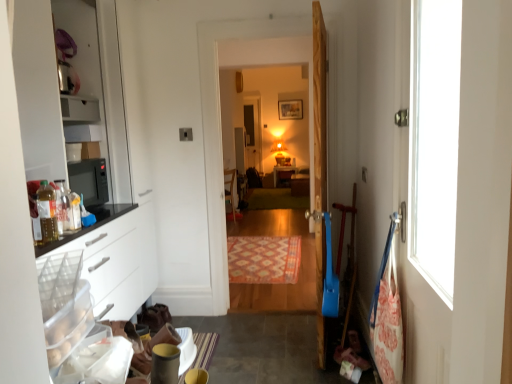
This screenshot has height=384, width=512. Identify the location of white glossy dresser at left. (69, 95).

I want to click on carpeted wooden floor at center, so click(x=267, y=100).

Where is `wooden door at center`? wooden door at center is located at coordinates (319, 165).

From the image's perspective, which is above, green carpet at center, which is the 2th mat from bottom to top, or translucent plastic bottle at left?

translucent plastic bottle at left appears higher in the image.

Identify the location of food to the left of green carpet at center, the 1th mat positioned from the back. The image size is (512, 384). (46, 210).

Is translucent plastic bottle at left a part of green carpet at center, the 1th mat positioned from the back?

No, translucent plastic bottle at left is not a part of green carpet at center, the 1th mat positioned from the back.

Who is bigger, wooden table at center or wooden door at center?

wooden door at center is bigger.

Is wooden table at center to the right of wooden door at center from the viewer's perspective?

Yes.

Is wooden table at center further to camera compared to wooden door at center?

Yes, wooden table at center is further from the viewer.

Is point (277, 174) positioned in front of point (314, 91)?

No, (277, 174) is behind (314, 91).

Between matte yellow concrete at lower left and matte white cabinet at center, which one is positioned in front?

matte yellow concrete at lower left is more forward.

Considering the positions of point (190, 317) and point (298, 181), is point (190, 317) closer or farther from the camera than point (298, 181)?

Point (190, 317) is positioned closer to the camera compared to point (298, 181).

From the image's perspective, which one is positioned higher, matte yellow concrete at lower left or matte white cabinet at center?

matte white cabinet at center.

Does matte yellow concrete at lower left turn towards matte white cabinet at center?

No.

Which of these two, matte white cabinet at center or wooden table at center, is thinner?

With smaller width is matte white cabinet at center.

Is matte white cabinet at center taller or shorter than wooden table at center?

Clearly, matte white cabinet at center is shorter compared to wooden table at center.

Considering their positions, is matte white cabinet at center located in front of or behind wooden table at center?

Clearly, matte white cabinet at center is in front of wooden table at center.

Is patterned carpet at center, the 2th mat in the back-to-front sequence, facing towards white glossy dresser at left?

No, patterned carpet at center, the 2th mat in the back-to-front sequence, is not turned towards white glossy dresser at left.

Between patterned carpet at center, the 2th mat in the back-to-front sequence, and white glossy dresser at left, which one has smaller width?

Thinner between the two is white glossy dresser at left.

Considering the relative sizes of patterned carpet at center, the 1th mat in the front-to-back sequence, and white glossy dresser at left in the image provided, is patterned carpet at center, the 1th mat in the front-to-back sequence, taller than white glossy dresser at left?

No, patterned carpet at center, the 1th mat in the front-to-back sequence, is not taller than white glossy dresser at left.

Between patterned carpet at center, the 1th mat in the front-to-back sequence, and white glossy dresser at left, which one appears on the right side from the viewer's perspective?

Positioned to the right is patterned carpet at center, the 1th mat in the front-to-back sequence.

Which of these two, matte yellow concrete at lower left or white glossy dresser at left, is smaller?

matte yellow concrete at lower left is smaller.

Does matte yellow concrete at lower left have a greater width compared to white glossy dresser at left?

Yes.

Looking at this image, from the image's perspective, is matte yellow concrete at lower left located above white glossy dresser at left?

No.

Which is correct: matte yellow concrete at lower left is inside white glossy dresser at left, or outside of it?

The correct answer is: outside.

The width and height of the screenshot is (512, 384). I want to click on corridor lying behind the wooden door at center, so click(x=267, y=100).

Is carpeted wooden floor at center taller or shorter than wooden door at center?

Clearly, carpeted wooden floor at center is taller compared to wooden door at center.

From a real-world perspective, is carpeted wooden floor at center on wooden door at center?

Correct, in the physical world, carpeted wooden floor at center is higher than wooden door at center.

This screenshot has width=512, height=384. What are the coordinates of `food above the green carpet at center, which is the first mat in top-to-bottom order (from the image's perspective)` in the screenshot? It's located at (46, 210).

Find the location of a particular element. The width and height of the screenshot is (512, 384). door on the left side of wooden table at center is located at coordinates (319, 165).

When comparing their distances from translucent plastic bottle at left, does patterned carpet at center, which is the 1th mat from bottom to top, or wooden door at center seem further?

patterned carpet at center, which is the 1th mat from bottom to top.

Which object lies nearer to the anchor point green carpet at center, which is the 2th mat from bottom to top, carpeted wooden floor at center or translucent plastic bottle at left?

The object closer to green carpet at center, which is the 2th mat from bottom to top, is carpeted wooden floor at center.

Considering their positions, is wooden door at center positioned closer to matte white cabinet at center than matte yellow concrete at lower left?

matte yellow concrete at lower left lies closer to matte white cabinet at center than the other object.

Estimate the real-world distances between objects in this image. Which object is further from matte yellow concrete at lower left, wooden table at center or translucent plastic bottle at left?

wooden table at center is positioned further to the anchor matte yellow concrete at lower left.

Considering their positions, is white glossy dresser at left positioned further to patterned carpet at center, which appears as the 2th mat when viewed from the top, than matte white cabinet at center?

matte white cabinet at center.

Based on their spatial positions, is wooden table at center or translucent plastic bottle at left further from matte white cabinet at center?

translucent plastic bottle at left is positioned further to the anchor matte white cabinet at center.

Based on their spatial positions, is green carpet at center, which is the 2th mat from front to back, or wooden door at center further from wooden chair at center?

The object further to wooden chair at center is wooden door at center.

In the scene shown: Looking at the image, which one is located further to green carpet at center, which is the 2th mat from front to back, matte yellow concrete at lower left or matte white cabinet at center?

The object further to green carpet at center, which is the 2th mat from front to back, is matte yellow concrete at lower left.

Locate an element on the screen. The image size is (512, 384). mat between wooden door at center and green carpet at center, which is the first mat in top-to-bottom order, along the z-axis is located at coordinates (264, 259).

Locate an element on the screen. This screenshot has height=384, width=512. chair located between wooden door at center and wooden table at center in the depth direction is located at coordinates (230, 191).

Where is `door between translucent plastic bottle at left and wooden table at center along the z-axis`? The image size is (512, 384). door between translucent plastic bottle at left and wooden table at center along the z-axis is located at coordinates (319, 165).

What are the coordinates of `mat between matte yellow concrete at lower left and green carpet at center, which is the 2th mat from front to back, along the z-axis` in the screenshot? It's located at (264, 259).